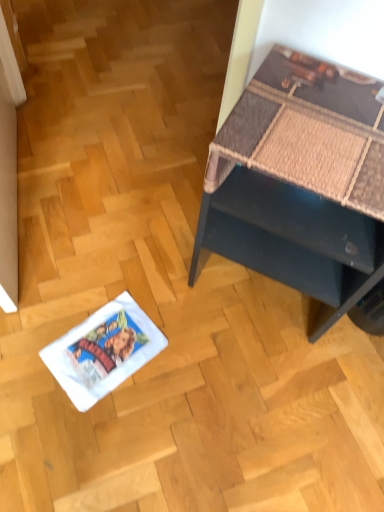
At what (x,y) coordinates should I click in order to perform the action: click on vacant space situated on the left part of white paper comic book at lower left. Please return your answer as a coordinate pair (x, y). Image resolution: width=384 pixels, height=512 pixels. Looking at the image, I should click on (36, 324).